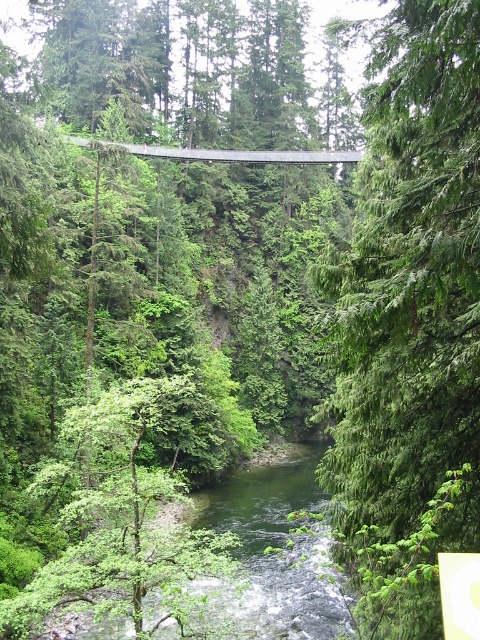
Is green matte tree at upper center positioned at the back of green leafy stream at center?

That is False.

Is point (347, 474) closer to camera compared to point (206, 624)?

Yes.

The height and width of the screenshot is (640, 480). I want to click on green matte tree at upper center, so click(x=408, y=323).